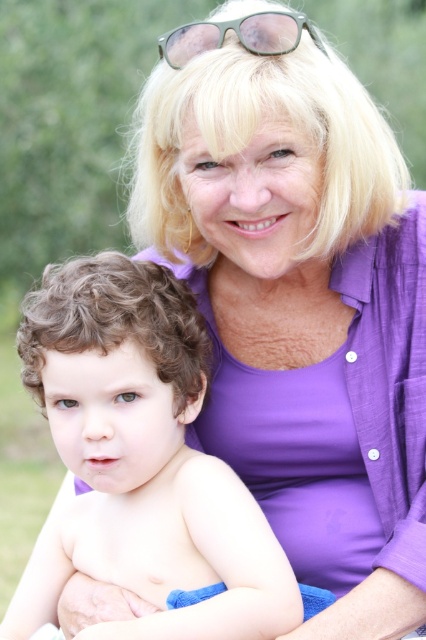
You are taking a photo of two people in the scene. The first person is at point (x=129, y=312) and the second is at point (x=184, y=60). Which point is closer to the camera?

Point (x=129, y=312) is closer to the camera than point (x=184, y=60).

You are a photographer standing 1.5 meters away from the camera. You want to take a closeup shot of the curly hair at center. Can you reach it without moving the camera?

The curly hair at center is 1.52 meters from camera, so you are 1.5 meters away from the camera. Therefore, you can reach the curly hair at center without moving the camera because you are closer than the subject.

You are a photographer trying to capture a closeup shot of the curly hair at center and the green matte sunglasses at upper center. Which object should you zoom in on first to ensure both are in focus?

The curly hair at center is bigger than the green matte sunglasses at upper center, so you should zoom in on the curly hair at center first to ensure both are in focus.